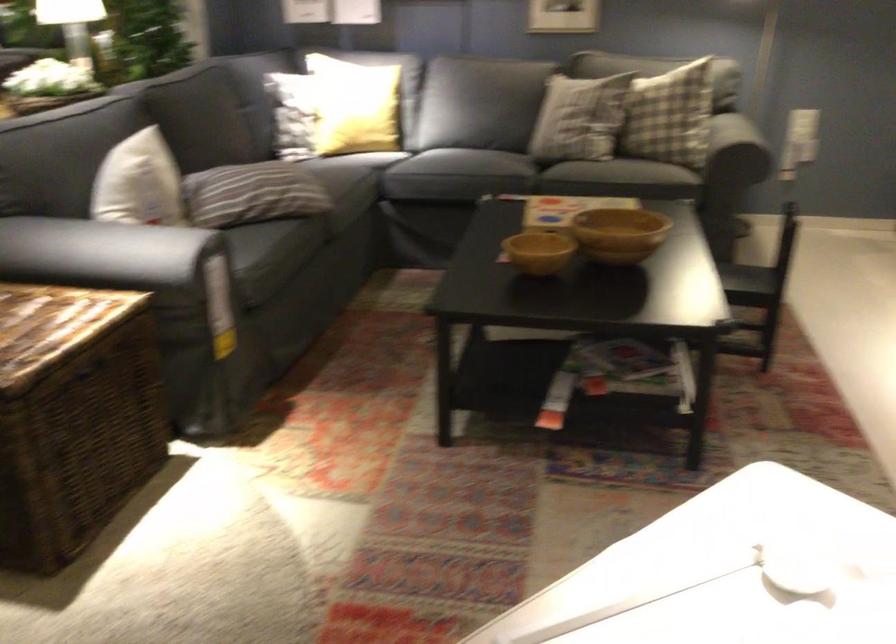
This screenshot has width=896, height=644. What do you see at coordinates (55, 317) in the screenshot?
I see `the wicker trunk lid` at bounding box center [55, 317].